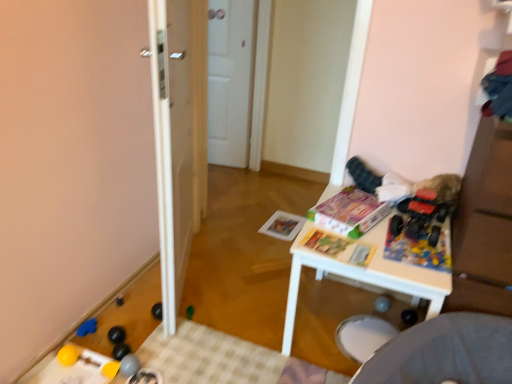
I want to click on free region on the left part of rubberized gray ball at lower left, which is the 4th toy from left to right, so click(x=89, y=360).